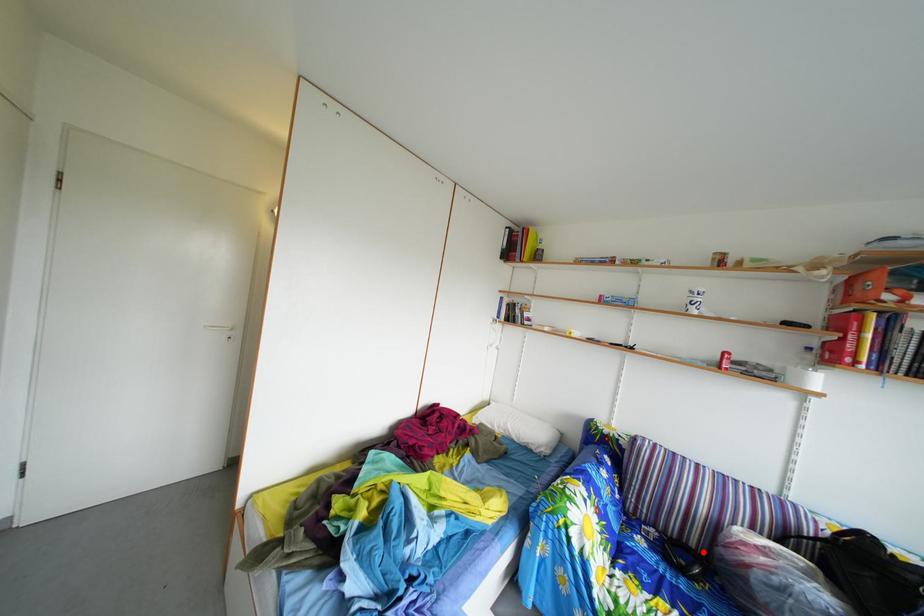
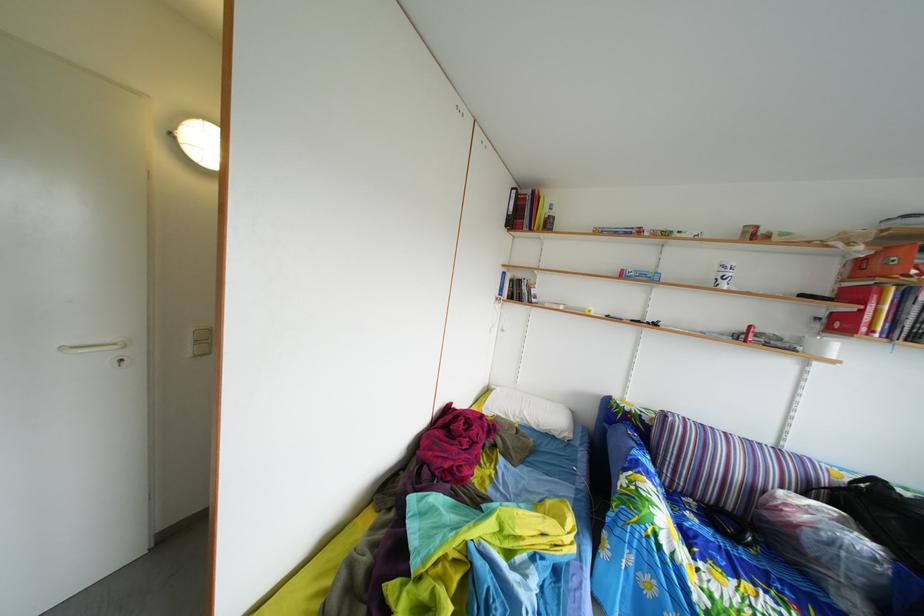
Find the pixel in the second image that matches the highlighted location in the first image.

(739, 516)